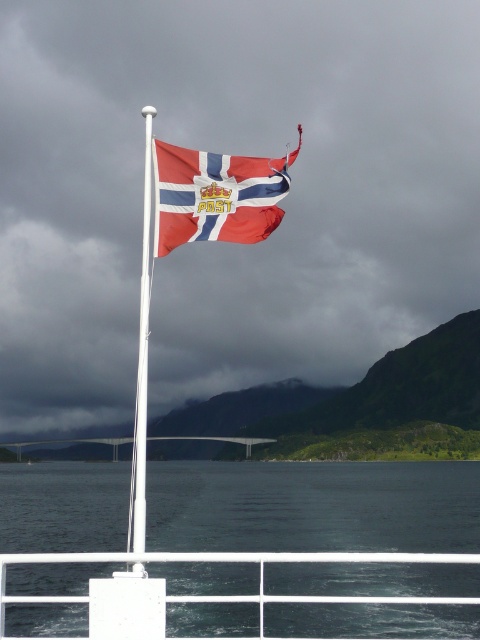
You are standing on the boat with the white railing. There is a point marked at coordinates point (x=313, y=506). What is located at that point?

At point (x=313, y=506) lies dark blue water at center.

You are an observer on the boat looking at the matte fabric flag at center and the white metallic flag pole at upper center. Which object takes up more area in the scene?

The white metallic flag pole at upper center occupies more space than the matte fabric flag at center, so the white metallic flag pole at upper center takes up more area in the scene.

You are on a boat and want to attach a new flag to the flagpole. The current flag is the matte fabric flag at center. Where should you place the new flag relative to the white metallic flag pole at upper center?

The matte fabric flag at center is currently on the right side of the white metallic flag pole at upper center, so the new flag should be placed to the left side of the white metallic flag pole at upper center to avoid overlapping.